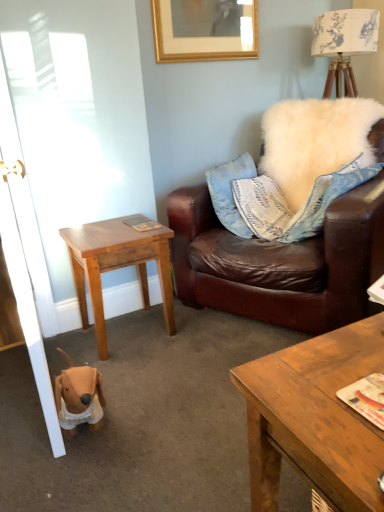
Question: Is white glossy door at left positioned beyond the bounds of wooden coffee table at lower right?

Choices:
 (A) yes
 (B) no

Answer: (A)

Question: Is white glossy door at left behind wooden coffee table at lower right?

Choices:
 (A) no
 (B) yes

Answer: (B)

Question: Considering the relative positions of white glossy door at left and wooden coffee table at lower right in the image provided, is white glossy door at left to the left of wooden coffee table at lower right from the viewer's perspective?

Choices:
 (A) yes
 (B) no

Answer: (A)

Question: Is white glossy door at left thinner than wooden coffee table at lower right?

Choices:
 (A) no
 (B) yes

Answer: (A)

Question: Is white glossy door at left in front of wooden coffee table at lower right?

Choices:
 (A) no
 (B) yes

Answer: (A)

Question: Could you tell me if white glossy door at left is facing wooden coffee table at lower right?

Choices:
 (A) yes
 (B) no

Answer: (B)

Question: Is white glossy door at left taller than gold wooden picture frame at upper center?

Choices:
 (A) no
 (B) yes

Answer: (B)

Question: Does white glossy door at left have a larger size compared to gold wooden picture frame at upper center?

Choices:
 (A) yes
 (B) no

Answer: (A)

Question: Is white glossy door at left turned away from gold wooden picture frame at upper center?

Choices:
 (A) yes
 (B) no

Answer: (B)

Question: Does white glossy door at left have a greater width compared to gold wooden picture frame at upper center?

Choices:
 (A) no
 (B) yes

Answer: (B)

Question: Are white glossy door at left and gold wooden picture frame at upper center beside each other?

Choices:
 (A) no
 (B) yes

Answer: (A)

Question: Could you tell me if white glossy door at left is facing gold wooden picture frame at upper center?

Choices:
 (A) no
 (B) yes

Answer: (A)

Question: Is white glossy door at left further to camera compared to light brown wooden table at lower left?

Choices:
 (A) no
 (B) yes

Answer: (A)